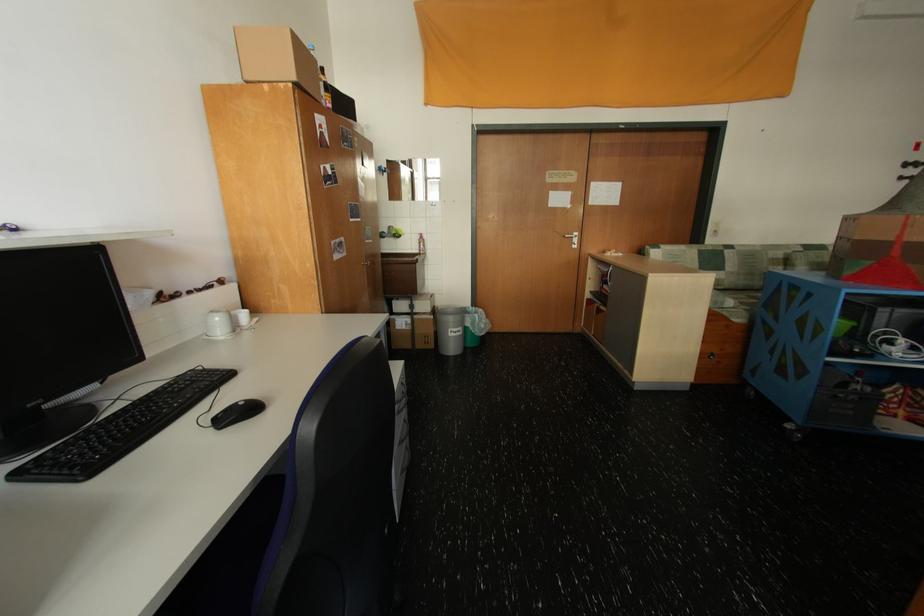
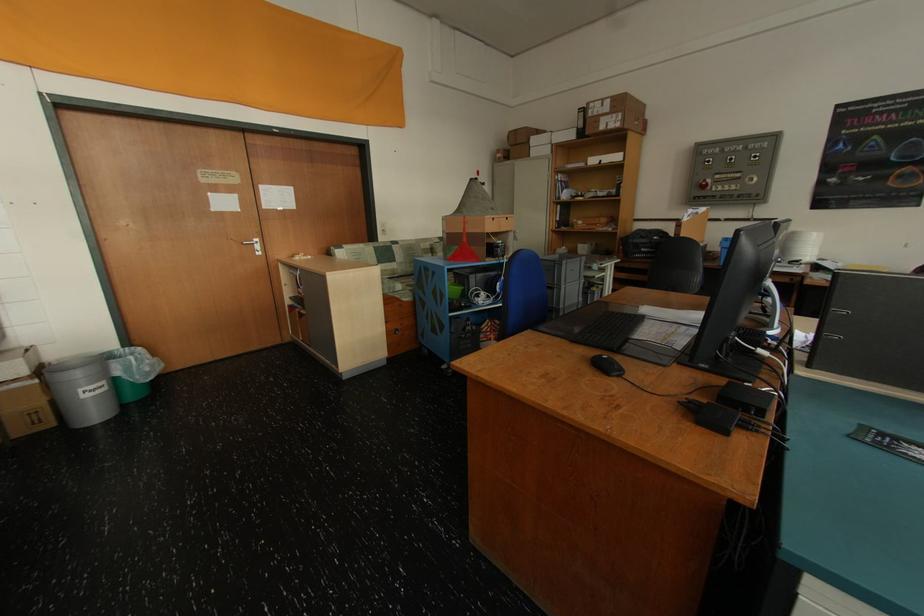
In the second image, find the point that corresponds to (x=573, y=238) in the first image.

(251, 245)